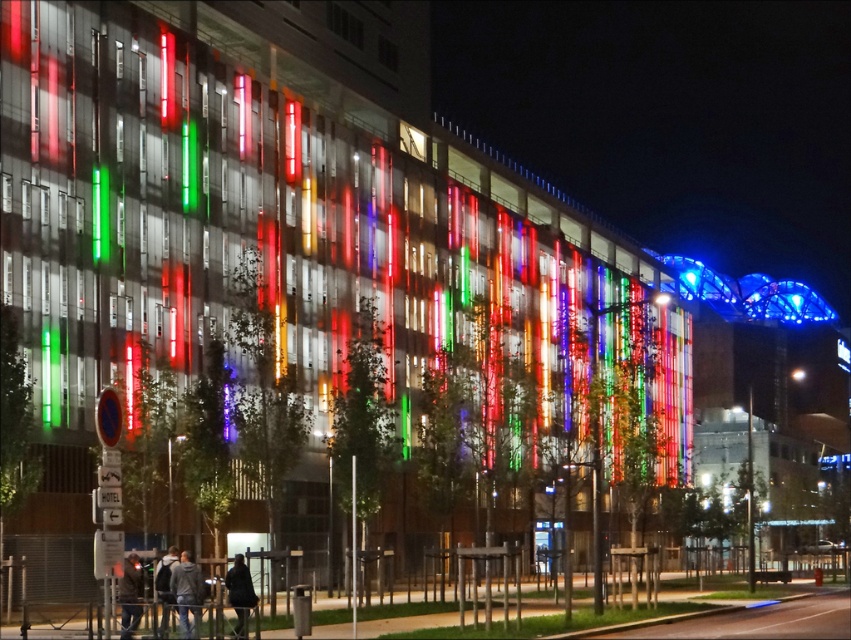
You are a delivery person standing on the sidewalk in front of the building. You need to place a package between the gray fabric jacket at lower center and the black fabric coat at lower center. Can you fit the package, which is 4 feet long, between them?

The gray fabric jacket at lower center and the black fabric coat at lower center are 4.25 feet apart, so yes, the package which is 4 feet long can fit between them since the distance is slightly larger than the package length.

You are standing on the sidewalk in front of the building and see a dark gray jacket at lower left and a black fabric coat at lower center. Which clothing item is nearer to you?

The dark gray jacket at lower left is closer to the viewer than the black fabric coat at lower center.